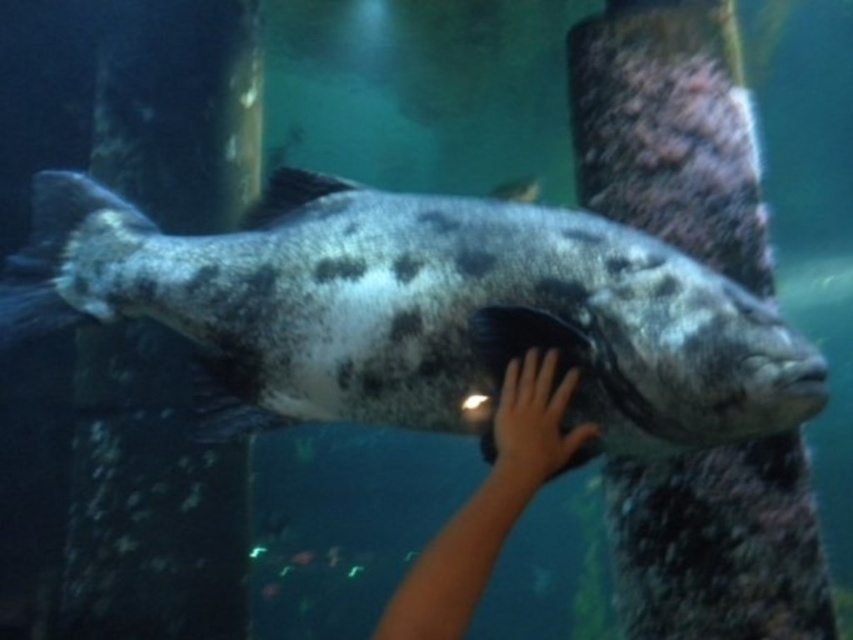
Question: Is speckled gray fish at center positioned behind smooth skin hand at center?

Choices:
 (A) no
 (B) yes

Answer: (A)

Question: Is the position of speckled gray fish at center more distant than that of smooth skin hand at center?

Choices:
 (A) no
 (B) yes

Answer: (A)

Question: Which point is farther from the camera taking this photo?

Choices:
 (A) (538, 369)
 (B) (107, 296)

Answer: (B)

Question: Which of the following is the closest to the observer?

Choices:
 (A) 500,476
 (B) 337,323

Answer: (A)

Question: Considering the relative positions of speckled gray fish at center and smooth skin hand at center in the image provided, where is speckled gray fish at center located with respect to smooth skin hand at center?

Choices:
 (A) above
 (B) below

Answer: (A)

Question: Which of the following is the closest to the observer?

Choices:
 (A) (636, 321)
 (B) (497, 481)

Answer: (B)